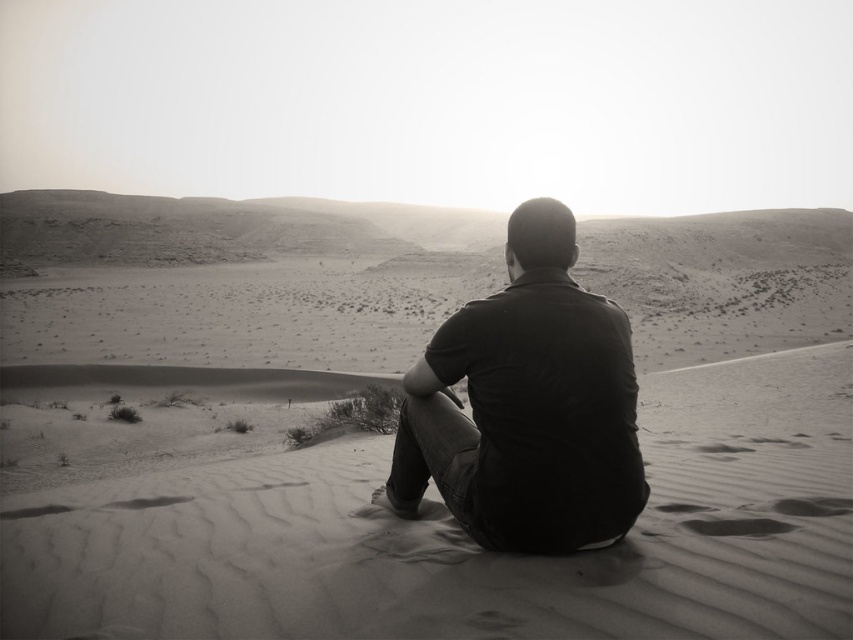
Question: Which object is farther from the camera taking this photo?

Choices:
 (A) smooth sand at center
 (B) dark cotton shirt at center

Answer: (B)

Question: Can you confirm if smooth sand at center is wider than dark cotton shirt at center?

Choices:
 (A) no
 (B) yes

Answer: (B)

Question: Among these objects, which one is farthest from the camera?

Choices:
 (A) dark cotton shirt at center
 (B) smooth sand at center

Answer: (A)

Question: Considering the relative positions of smooth sand at center and dark cotton shirt at center in the image provided, where is smooth sand at center located with respect to dark cotton shirt at center?

Choices:
 (A) left
 (B) right

Answer: (B)

Question: Which of the following is the closest to the observer?

Choices:
 (A) dark cotton shirt at center
 (B) smooth sand at center

Answer: (B)

Question: Is smooth sand at center to the right of dark cotton shirt at center from the viewer's perspective?

Choices:
 (A) yes
 (B) no

Answer: (A)